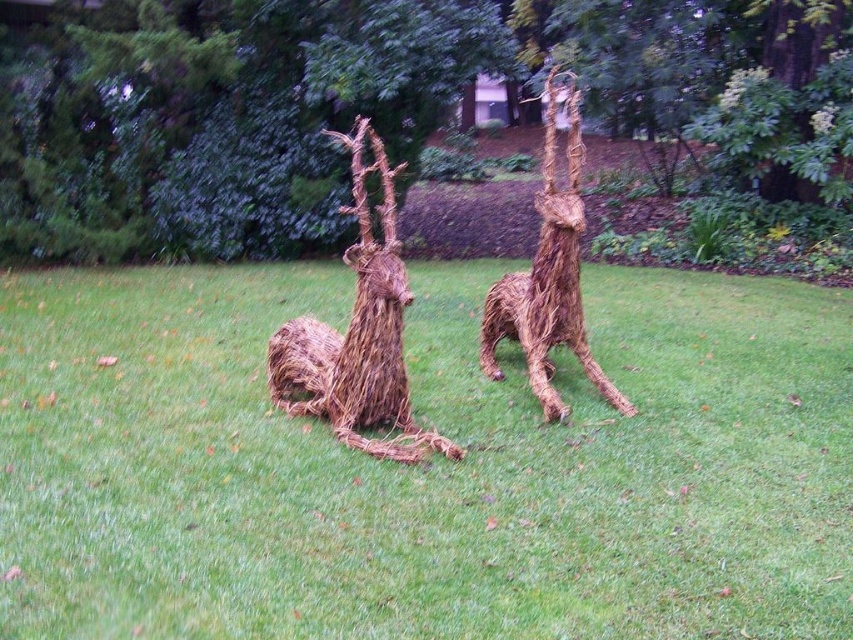
You are a gardener who wants to mow the green grass at center without hitting the braided straw giraffe at center. Which one should you move first when approaching from the front?

The green grass at center is closer to you than the braided straw giraffe at center, so you should mow the green grass at center first before reaching the braided straw giraffe at center.

In the scene shown: You are a gardener checking the layout of the garden. You see the green grass at center and the braided straw giraffe at center. Which object is positioned lower in the scene?

The green grass at center is positioned below the braided straw giraffe at center, so the green grass at center is lower in the scene.